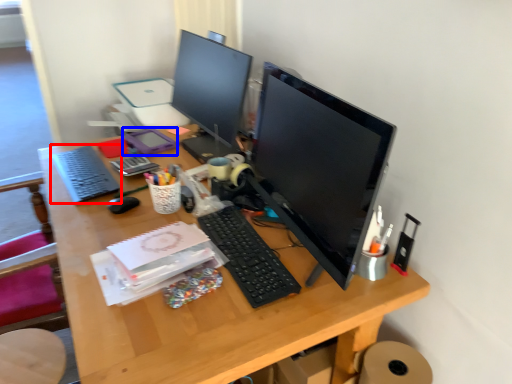
Question: Which object appears farthest to the camera in this image, computer keyboard (highlighted by a red box) or stationery (highlighted by a blue box)?

Choices:
 (A) computer keyboard
 (B) stationery

Answer: (B)